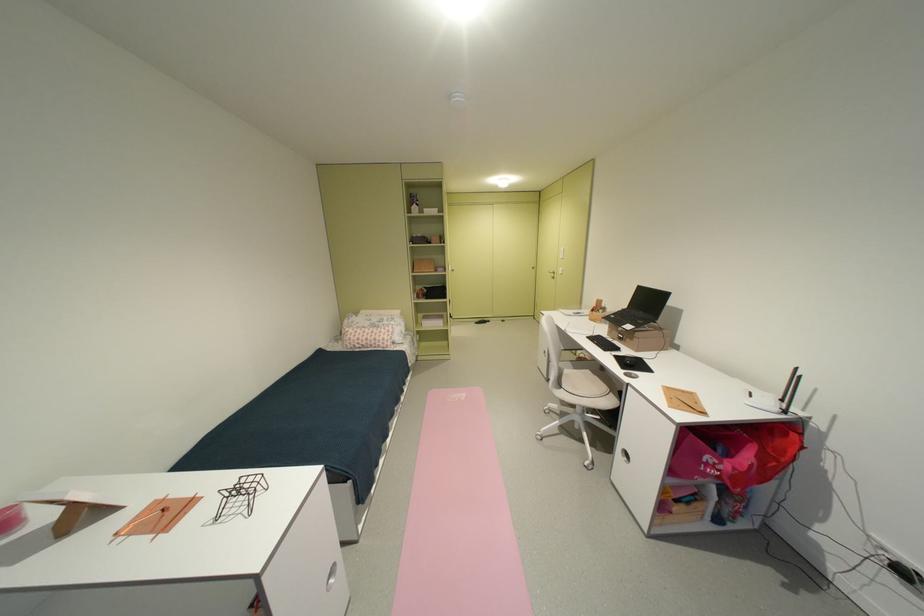
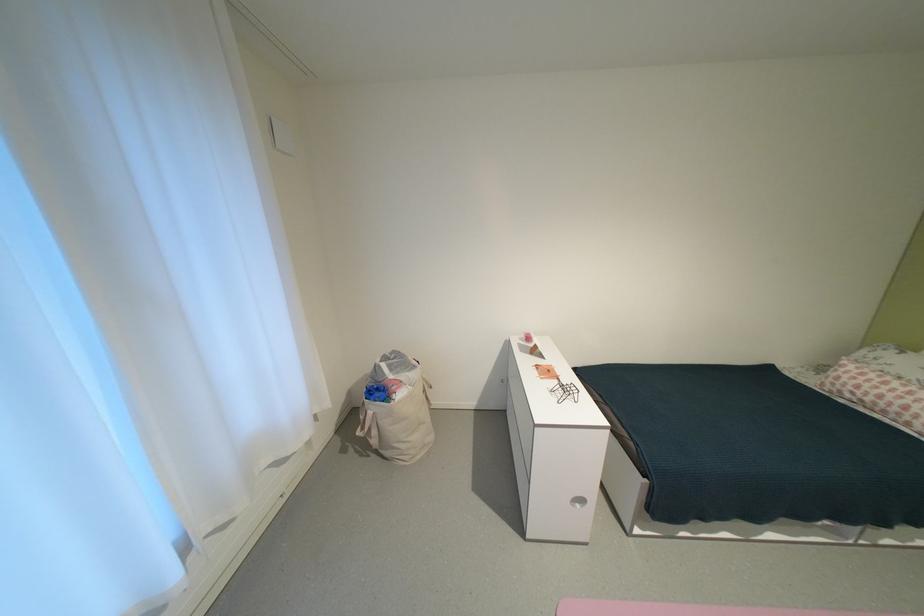
Locate, in the second image, the point that corresponds to [235,501] in the first image.

(568, 387)